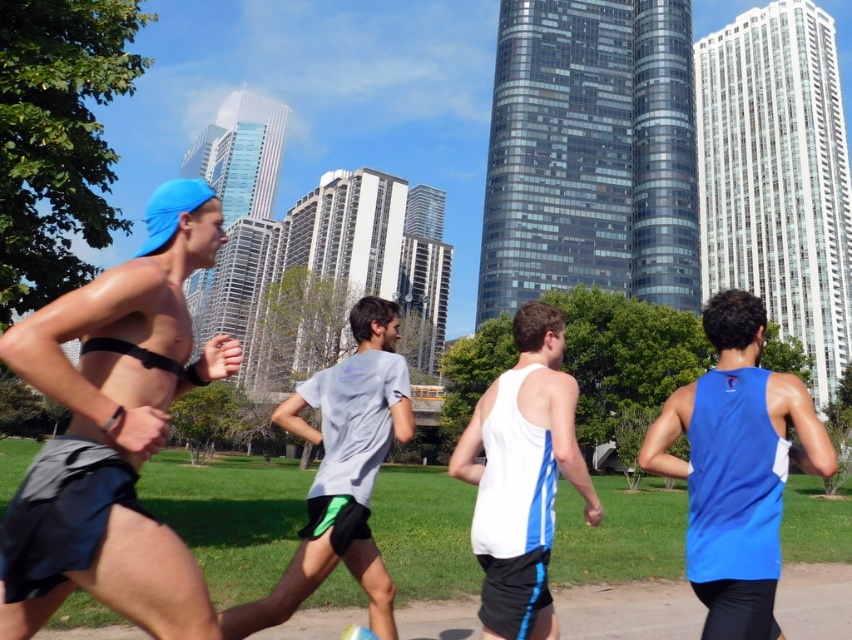
You are a photographer trying to capture the runner wearing the white matte tank top at center. Based on their position in the image, what coordinates should you aim for to ensure the tank top is centered in your shot?

The white matte tank top at center is located at point (522,476), so aim your camera at those coordinates to center it in the shot.

You are a photographer trying to capture a photo of the matte blue cap at left and the gray fabric shirt at center. Which object should you focus on first if you want to include both in your frame without moving the camera?

The matte blue cap at left is not as tall as the gray fabric shirt at center, so you should focus on the gray fabric shirt at center first to ensure it fits within the frame.

You are a photographer trying to capture a clear shot of the gray fabric shirt at center. Since the white matte tank top at center is blocking your view, can you move to the left to get a better angle? Explain why or why not based on their positions.

The gray fabric shirt at center is behind the white matte tank top at center, so moving to the left might not help because the white matte tank top at center is still in front. To get a clear shot of the gray fabric shirt at center, you would need to position yourself where the white matte tank top at center is no longer blocking the view, possibly by moving to the right or adjusting the angle so that the gray fabric shirt at center becomes visible around or past the white matte tank top at center.